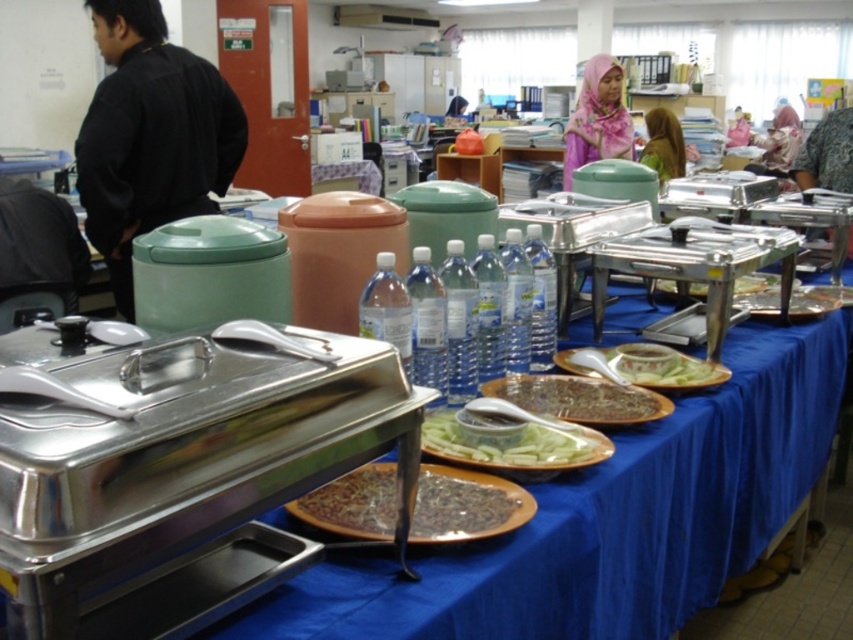
Question: Which object appears closest to the camera in this image?

Choices:
 (A) white glossy bowl at center
 (B) pink fabric headscarf at upper center

Answer: (A)

Question: Is black matte shirt at left smaller than pink fabric headscarf at upper center?

Choices:
 (A) yes
 (B) no

Answer: (A)

Question: Is white glossy bowl at center thinner than brown fabric hijab at upper center?

Choices:
 (A) no
 (B) yes

Answer: (B)

Question: Which object is farther from the camera taking this photo?

Choices:
 (A) translucent plastic container at center
 (B) blue fabric tablecloth at center
 (C) brown matte rice at center
 (D) green plastic bowl at center

Answer: (A)

Question: Is black matte shirt at left bigger than pink fabric hijab at upper center?

Choices:
 (A) no
 (B) yes

Answer: (A)

Question: Among these points, which one is nearest to the camera?

Choices:
 (A) (680, 145)
 (B) (614, 154)
 (C) (140, 28)
 (D) (343, 512)

Answer: (D)